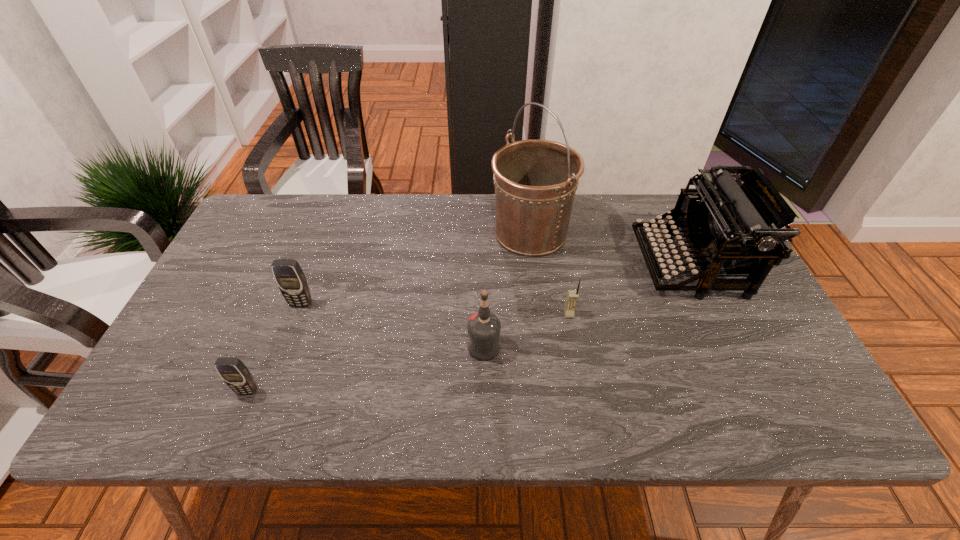
You are a GUI agent. You are given a task and a screenshot of the screen. Output one action in this format:
    pyautogui.click(x=<x>, y=<y>)
    Task: Click on the typewriter positioned at the far edge
    The image size is (960, 540).
    Given the screenshot: What is the action you would take?
    pyautogui.click(x=730, y=226)

Find the location of a particular element. This screenshot has height=540, width=960. object situated at the near edge is located at coordinates (235, 374).

Identify the location of object present at the right edge. pyautogui.click(x=730, y=226).

Where is `object positioned at the far right corner`? object positioned at the far right corner is located at coordinates (730, 226).

You are a GUI agent. You are given a task and a screenshot of the screen. Output one action in this format:
    pyautogui.click(x=<x>, y=<y>)
    Task: Click on the free space at the far edge of the desktop
    This screenshot has height=540, width=960.
    Given the screenshot: What is the action you would take?
    pyautogui.click(x=304, y=209)

Locate an element on the screen. This screenshot has height=540, width=960. free space at the near edge of the desktop is located at coordinates (558, 413).

In the image, there is a desktop. Where is `vacant space at the right edge`? This screenshot has height=540, width=960. vacant space at the right edge is located at coordinates (752, 320).

Image resolution: width=960 pixels, height=540 pixels. Find the location of `vacant space at the far left corner of the desktop`. vacant space at the far left corner of the desktop is located at coordinates (239, 233).

The width and height of the screenshot is (960, 540). Find the location of `vacant space at the far right corner`. vacant space at the far right corner is located at coordinates (654, 205).

This screenshot has width=960, height=540. In the image, there is a desktop. Find the location of `vacant space at the near right corner`. vacant space at the near right corner is located at coordinates (768, 426).